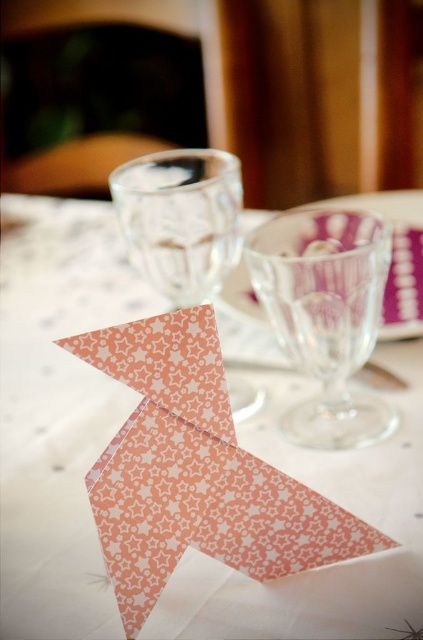
Question: Can you confirm if pink paper origami at center is positioned below transparent glass wine glass at center?

Choices:
 (A) no
 (B) yes

Answer: (A)

Question: Among these points, which one is nearest to the camera?

Choices:
 (A) click(x=172, y=237)
 (B) click(x=316, y=403)
 (C) click(x=52, y=612)

Answer: (C)

Question: Among these points, which one is nearest to the camera?

Choices:
 (A) (238, 172)
 (B) (415, 445)
 (C) (299, 211)

Answer: (B)

Question: Is pink paper origami at center to the left of clear glass wine glass at center from the viewer's perspective?

Choices:
 (A) yes
 (B) no

Answer: (A)

Question: Does clear glass wine glass at center have a greater width compared to transparent glass wine glass at center?

Choices:
 (A) yes
 (B) no

Answer: (B)

Question: Which object appears farthest from the camera in this image?

Choices:
 (A) transparent glass wine glass at center
 (B) clear glass wine glass at center
 (C) pink paper origami at center

Answer: (A)